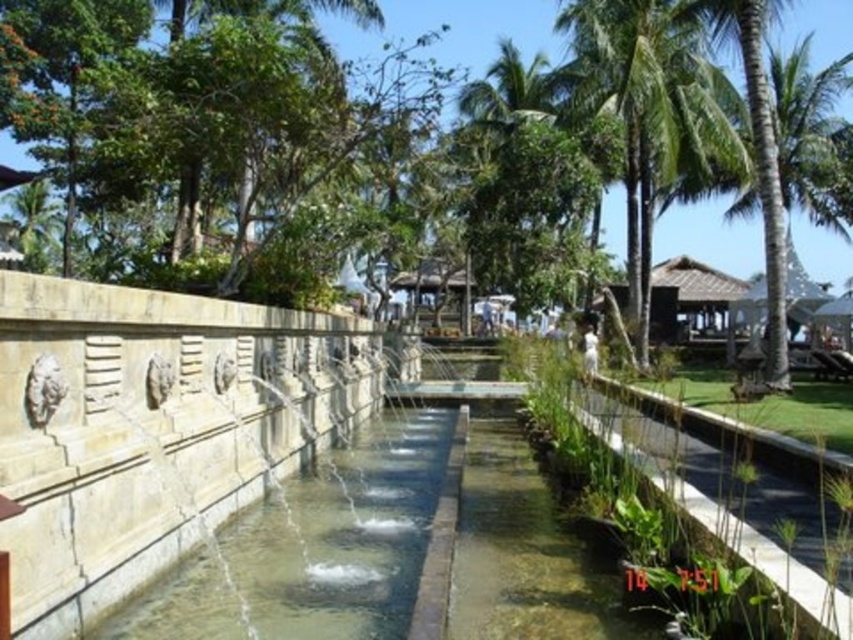
You are a gardener planning to walk along the clear concrete pathway at center while carrying a large gardening tool. Considering the width of the pathway, will you have enough space to walk comfortably without touching the green leafy tree at upper center?

The clear concrete pathway at center has a lesser width compared to green leafy tree at upper center, so it may be tight to walk comfortably with a large gardening tool without touching the tree.